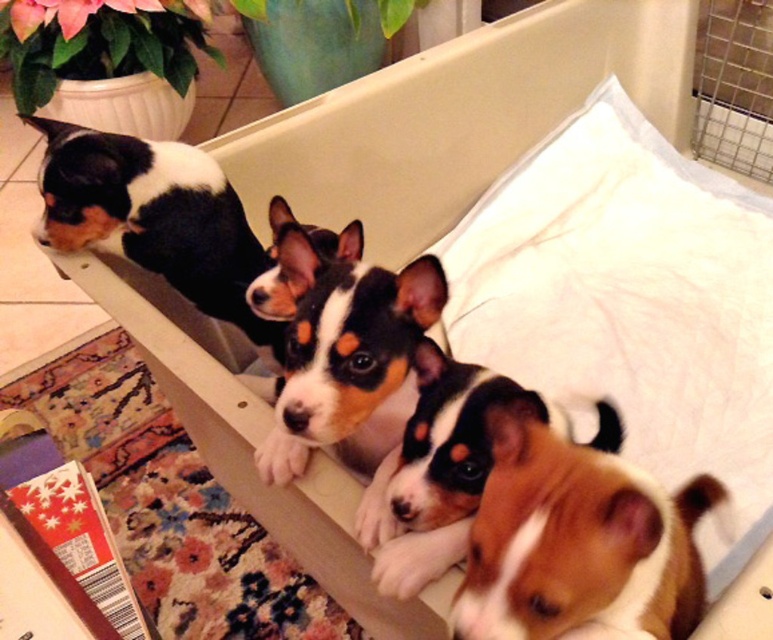
Question: Is brown furry dog at lower right smaller than black and white fur at center?

Choices:
 (A) yes
 (B) no

Answer: (A)

Question: Which of the following is the farthest from the observer?

Choices:
 (A) (310, 422)
 (B) (250, 257)
 (C) (601, 189)

Answer: (C)

Question: Where is white soft pillow at upper right located in relation to black and white fur at center in the image?

Choices:
 (A) right
 (B) left

Answer: (A)

Question: Which of the following is the closest to the observer?

Choices:
 (A) white soft pillow at upper right
 (B) brown furry dog at lower right

Answer: (B)

Question: Does white soft pillow at upper right have a larger size compared to brown furry dog at lower right?

Choices:
 (A) yes
 (B) no

Answer: (A)

Question: Considering the real-world distances, which object is closest to the black and white fur at upper left?

Choices:
 (A) brown furry dog at lower right
 (B) black and white fur at center
 (C) white soft pillow at upper right

Answer: (B)